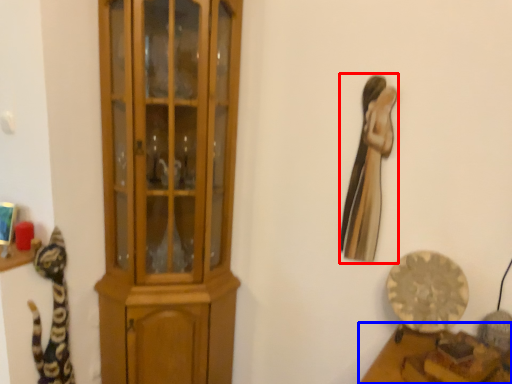
Question: Which object appears farthest to the camera in this image, animal (highlighted by a red box) or furniture (highlighted by a blue box)?

Choices:
 (A) animal
 (B) furniture

Answer: (A)